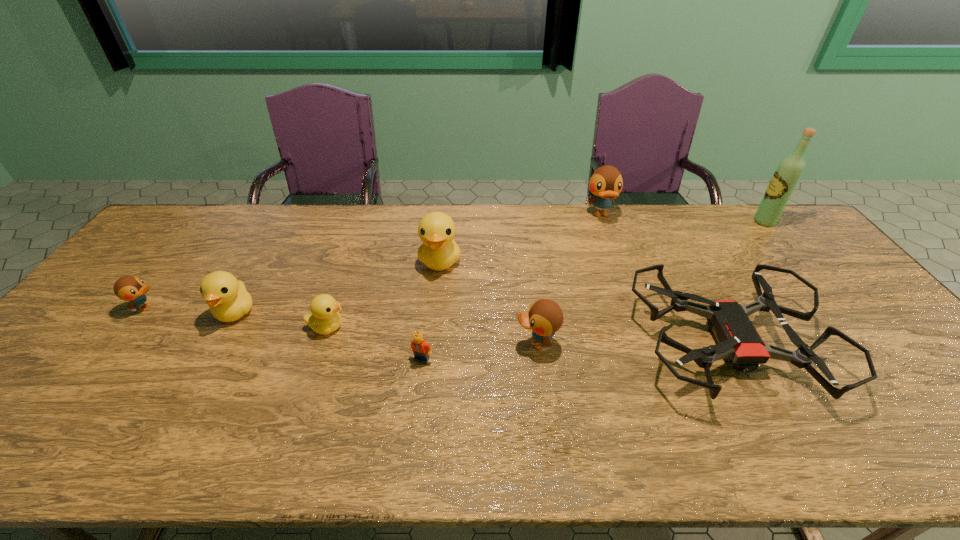
Identify the location of the smallest blue duck. (128, 288).

Find the location of a particular element. The image size is (960, 540). the leftmost blue duck is located at coordinates (128, 288).

Where is `the smallest yellow duck`? the smallest yellow duck is located at coordinates (325, 318).

I want to click on the second yellow duck from right to left, so click(325, 318).

At what (x,y) coordinates should I click in order to perform the action: click on drone. Please return your answer as a coordinate pair (x, y). Looking at the image, I should click on (739, 342).

At what (x,y) coordinates should I click in order to perform the action: click on orange Lego. Please return your answer as a coordinate pair (x, y). Image resolution: width=960 pixels, height=540 pixels. Looking at the image, I should click on (421, 350).

The width and height of the screenshot is (960, 540). I want to click on free space located on the front-facing side of the rightmost object, so click(x=684, y=222).

I want to click on free location located on the front-facing side of the rightmost object, so click(x=670, y=222).

Image resolution: width=960 pixels, height=540 pixels. I want to click on vacant space located on the front-facing side of the rightmost object, so click(x=667, y=222).

Image resolution: width=960 pixels, height=540 pixels. Find the location of `free location located on the front-facing side of the rightmost duck`. free location located on the front-facing side of the rightmost duck is located at coordinates (612, 246).